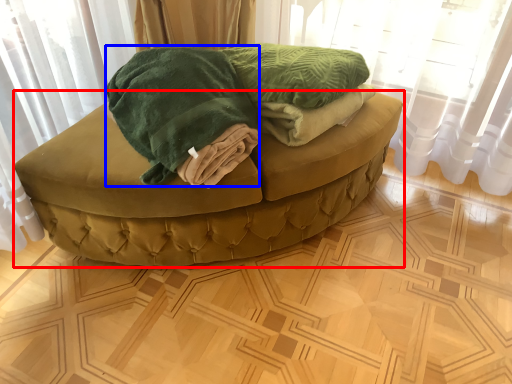
Question: Which point is closer to the camera, furniture (highlighted by a red box) or cloth (highlighted by a blue box)?

Choices:
 (A) furniture
 (B) cloth

Answer: (B)